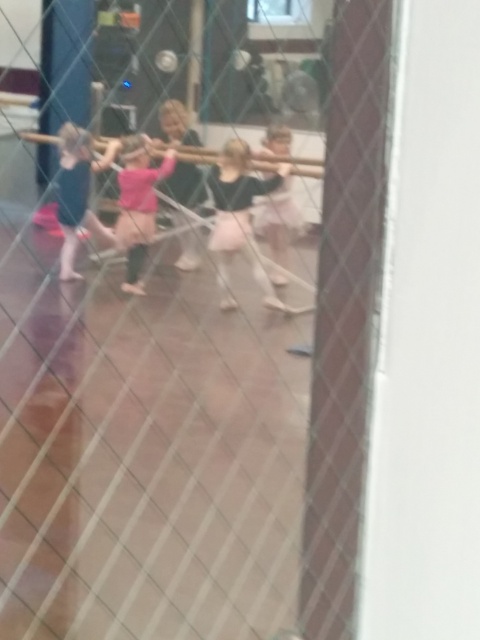
Between matte black ballet skirt at left and pink satin ballet skirt at center, which one is positioned lower?

Positioned lower is pink satin ballet skirt at center.

Is point (72, 241) less distant than point (288, 129)?

That is True.

Locate an element on the screen. The height and width of the screenshot is (640, 480). matte black ballet skirt at left is located at coordinates (78, 192).

Does point (239, 202) come behind point (279, 124)?

That is False.

Which is behind, point (239, 202) or point (260, 202)?

The point (260, 202) is more distant.

Where is `pink satin tutu at center`? This screenshot has width=480, height=640. pink satin tutu at center is located at coordinates (239, 216).

Who is taller, pink matte dress at center or pink satin ballet skirt at center?

Standing taller between the two is pink matte dress at center.

Is pink matte dress at center above pink satin ballet skirt at center?

Yes, pink matte dress at center is above pink satin ballet skirt at center.

Between point (130, 275) and point (262, 196), which one is positioned behind?

The point (130, 275) is more distant.

The width and height of the screenshot is (480, 640). Find the location of `pink matte dress at center`. pink matte dress at center is located at coordinates point(137,204).